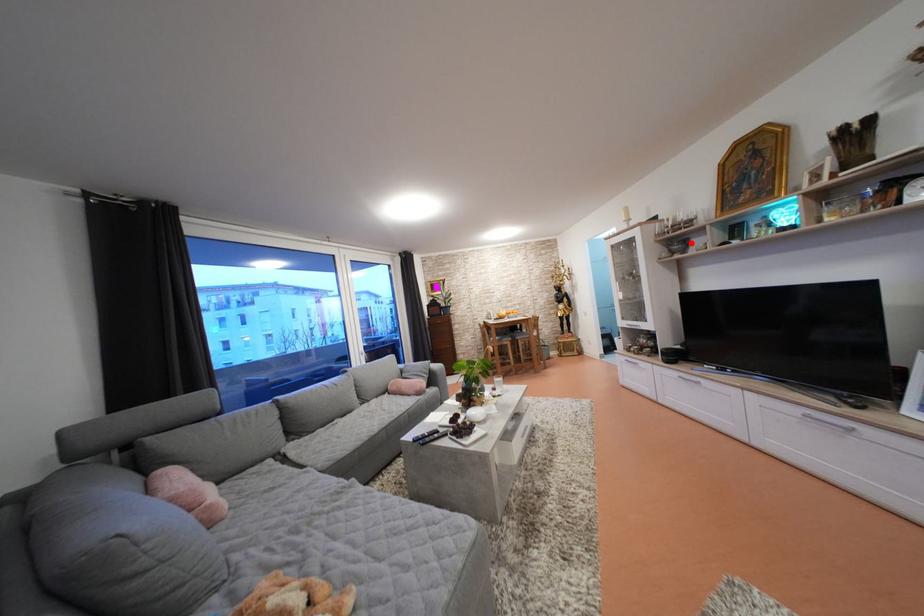
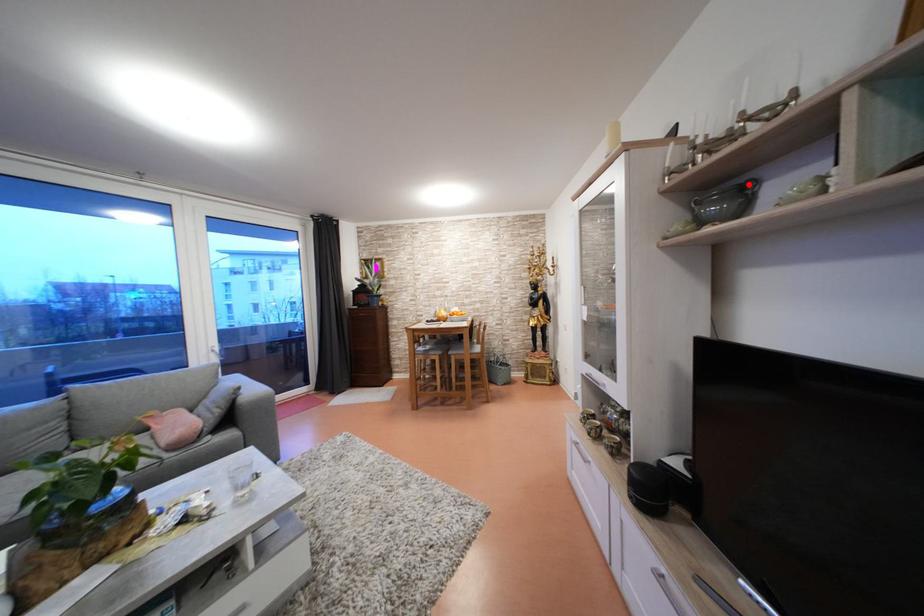
In the scene shown: I am providing you with two images of the same scene from different viewpoints. A red point is marked on the first image and another point is marked on the second image. Is the red point in image1 aligned with the point shown in image2?

Yes